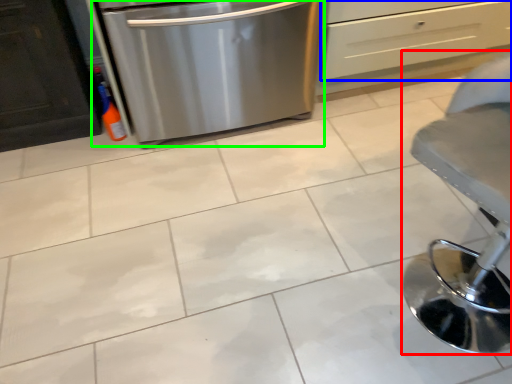
Question: Based on their relative distances, which object is nearer to furniture (highlighted by a red box)? Choose from drawer (highlighted by a blue box) and home appliance (highlighted by a green box).

Choices:
 (A) drawer
 (B) home appliance

Answer: (B)